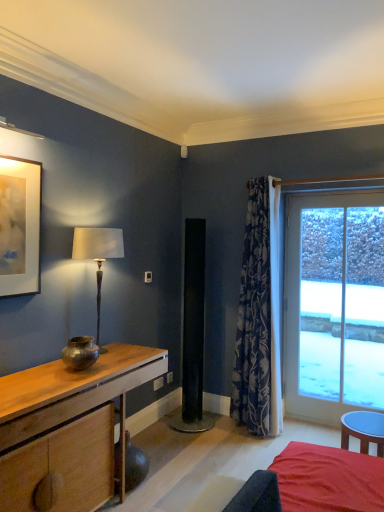
Question: Considering their positions, is matte bronze lamp at left located in front of or behind bronze metallic vase at left?

Choices:
 (A) behind
 (B) front

Answer: (A)

Question: Considering the positions of point (76, 256) and point (96, 352), is point (76, 256) closer or farther from the camera than point (96, 352)?

Choices:
 (A) farther
 (B) closer

Answer: (A)

Question: Estimate the real-world distances between objects in this image. Which object is farther from the blue floral fabric curtain at right?

Choices:
 (A) velvet red bed at lower right
 (B) bronze metallic vase at left
 (C) wooden desk at left
 (D) matte gold picture frame at upper left
 (E) transparent glass door at right

Answer: (D)

Question: Which of these objects is positioned farthest from the bronze metallic vase at left?

Choices:
 (A) velvet red bed at lower right
 (B) matte bronze lamp at left
 (C) matte gold picture frame at upper left
 (D) blue floral fabric curtain at right
 (E) wooden desk at left

Answer: (D)